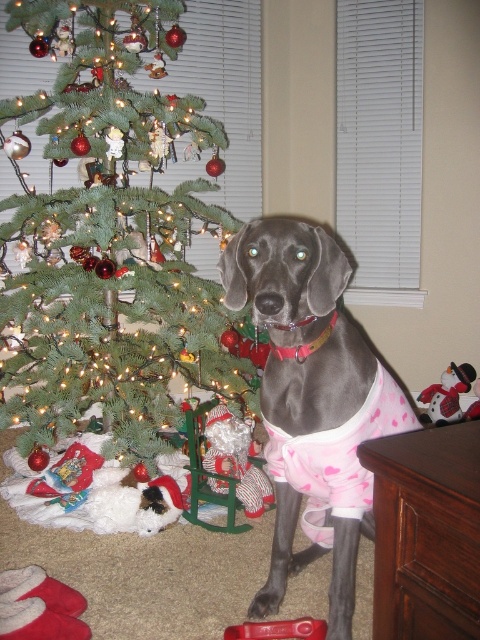
From the picture: You are planning to place a new ornament on the green matte christmas tree at center. Considering the size of the shiny gray dog at center, will the tree be wide enough to accommodate the ornament without it being blocked by the dog?

The green matte christmas tree at center is wider than the shiny gray dog at center, so the tree has enough width to place the ornament without it being blocked by the dog.